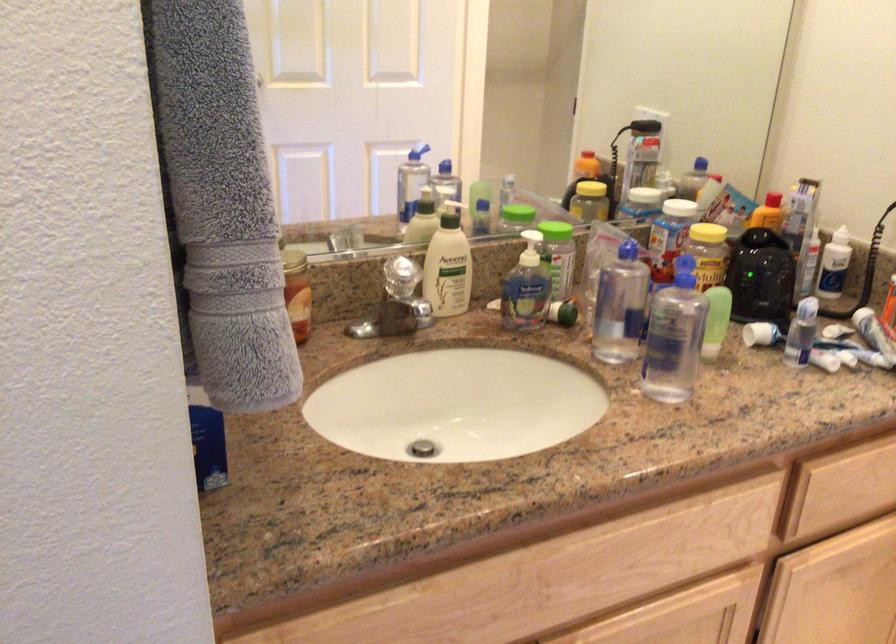
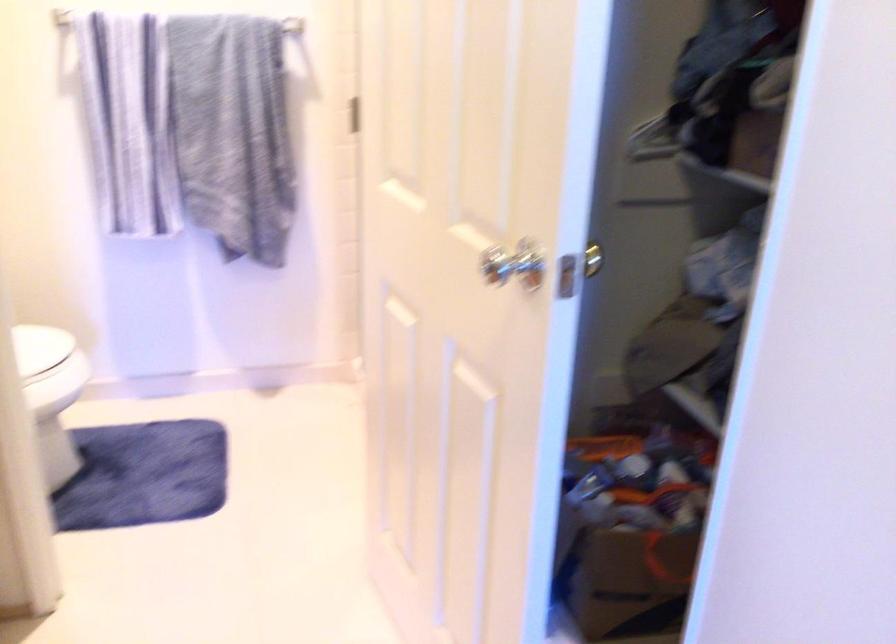
First-person continuous shooting, in which direction is the camera rotating?

The rotation direction of the camera is right-down.